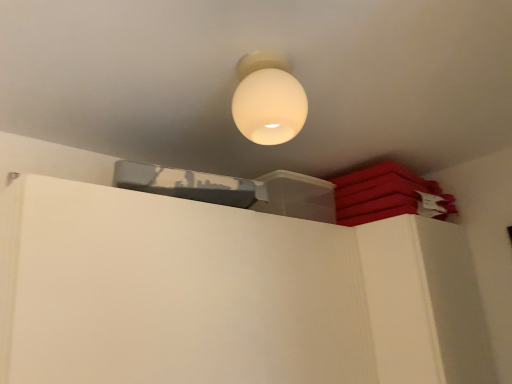
This screenshot has height=384, width=512. Describe the element at coordinates (268, 99) in the screenshot. I see `white matte sphere at upper center` at that location.

Where is `white matte sphere at upper center`? white matte sphere at upper center is located at coordinates (268, 99).

You are a GUI agent. You are given a task and a screenshot of the screen. Output one action in this format:
    pyautogui.click(x=<x>, y=<y>)
    Task: Click on the white matte sphere at upper center
    The height and width of the screenshot is (384, 512).
    Given the screenshot: What is the action you would take?
    pyautogui.click(x=268, y=99)